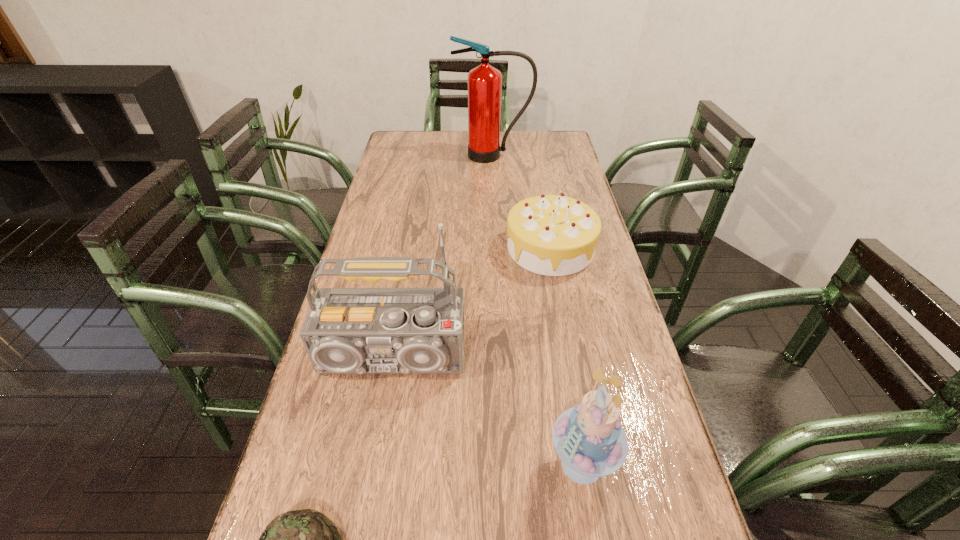
This screenshot has height=540, width=960. Identify the location of the tallest object. (484, 82).

Find the location of `the farthest object`. the farthest object is located at coordinates (484, 82).

The height and width of the screenshot is (540, 960). Identify the location of the fourth shortest object. point(347,330).

Where is `the third farthest object`? This screenshot has height=540, width=960. the third farthest object is located at coordinates (347, 330).

What are the coordinates of `the fourth farthest object` in the screenshot? It's located at (589, 438).

The image size is (960, 540). I want to click on the third tallest object, so click(589, 438).

I want to click on the second farthest object, so click(554, 235).

At what (x,y) coordinates should I click in order to perform the action: click on birthday cake. Please return your answer as a coordinate pair (x, y). This screenshot has width=960, height=540. Looking at the image, I should click on (554, 235).

This screenshot has width=960, height=540. Identify the location of blank space located 0.270m on the front of the tallest object. (495, 201).

Where is `free region located on the front-facing side of the radio receiver`? The image size is (960, 540). free region located on the front-facing side of the radio receiver is located at coordinates (380, 429).